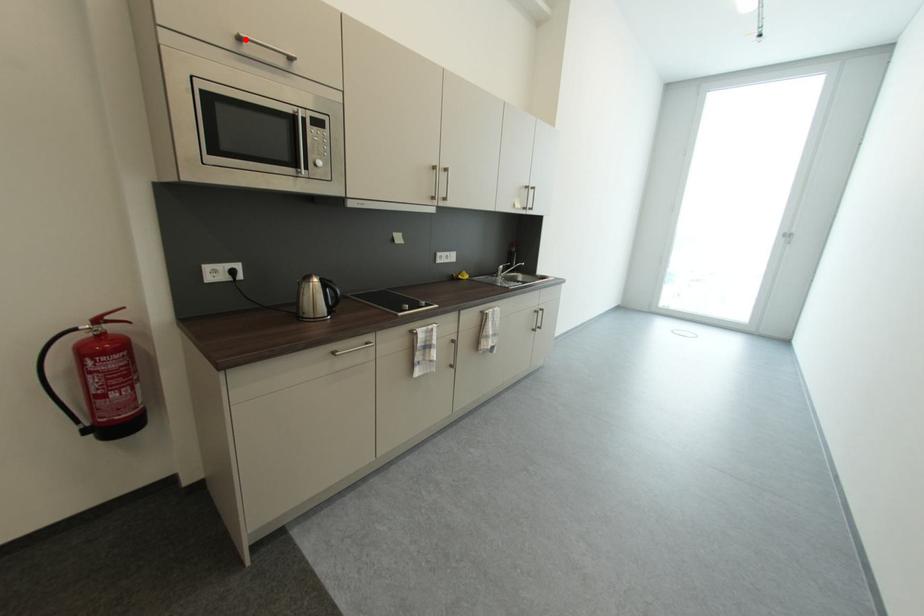
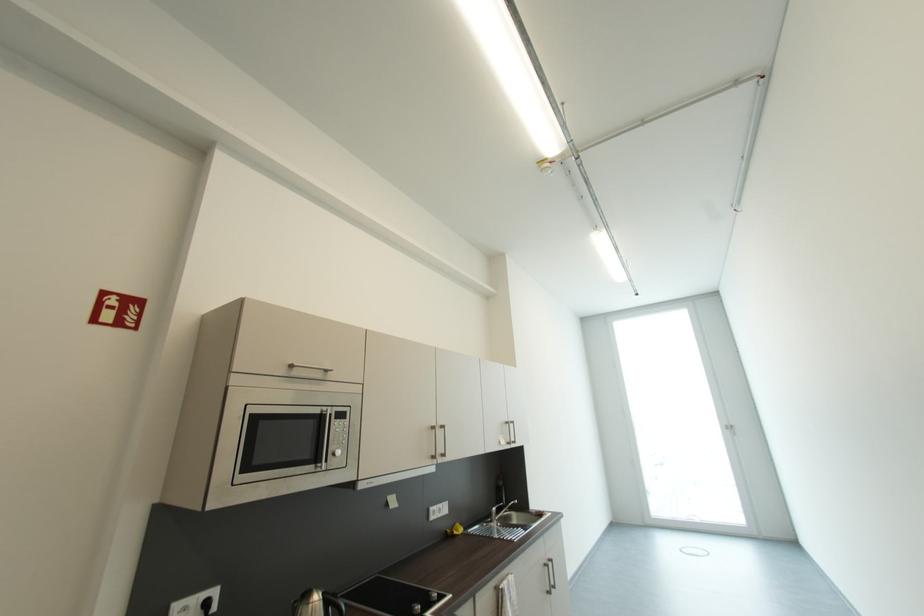
Where in the second image is the point corresponding to the highlighted location from the first image?

(298, 368)